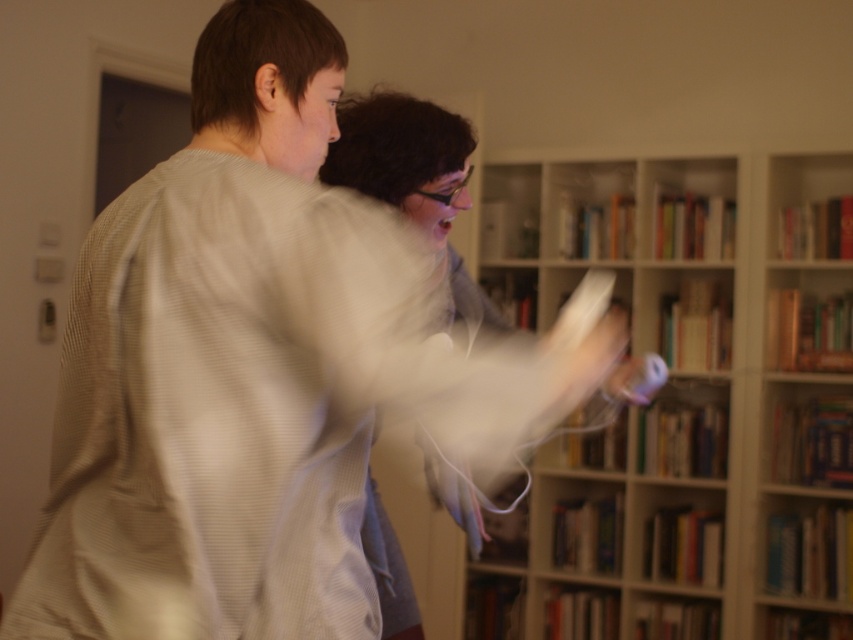
You are a delivery person who needs to place a new controller in the same location as the white matte controller at center. However, you notice the wooden bookshelf at center is blocking the spot. Can you still place the new controller there without moving the bookshelf?

The white matte controller at center is behind the wooden bookshelf at center, so you cannot place the new controller there without moving the bookshelf.

You are standing in the room where the wooden bookshelf at center is located. If you want to move the Wii controllers to the bookshelf, which direction should you move them?

The wooden bookshelf at center is located at point (x=693, y=400), so you should move the Wii controllers towards the center of the room to place them on the wooden bookshelf at center.

You are standing in the living room where two people are playing a video game with controllers. There are two points marked in the scene. The first point is at coordinate point (515, 269) and the second point is at coordinate point (1, 300). If you were to draw a straight line from your current position to both points, which point would require you to look upwards more?

The point at coordinate point (515, 269) would require looking upwards more because it is positioned behind point (1, 300), which means it has a higher vertical position in the scene.